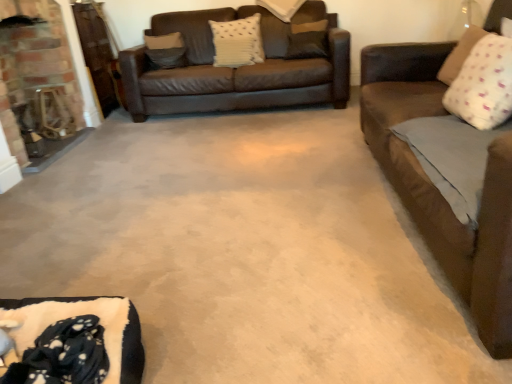
Question: Considering the positions of brick fireplace at left and white textured pillow at upper center, the third pillow viewed from the left, in the image, is brick fireplace at left taller or shorter than white textured pillow at upper center, the third pillow viewed from the left,?

Choices:
 (A) short
 (B) tall

Answer: (B)

Question: Is point (65, 67) closer or farther from the camera than point (286, 1)?

Choices:
 (A) farther
 (B) closer

Answer: (B)

Question: Which object is positioned farthest from the brown fabric pillow at upper center, the fourth pillow when ordered from left to right?

Choices:
 (A) black fleece blanket at lower left
 (B) brick fireplace at left
 (C) white textured pillow at center, the 5th pillow when ordered from right to left
 (D) suede-like beige pillow at upper left, which is the first pillow from back to front
 (E) white textured pillow at upper center, the fourth pillow viewed from the right

Answer: (A)

Question: Which is nearer to the white textured pillow at upper center, the fourth pillow viewed from the right?

Choices:
 (A) black fleece blanket at lower left
 (B) suede-like beige pillow at upper left, which is the first pillow from back to front
 (C) white soft pillow at upper right, the fifth pillow positioned from the left
 (D) white textured pillow at center, marked as the second pillow in a left-to-right arrangement
 (E) brown fabric pillow at upper center, the fourth pillow when ordered from left to right

Answer: (E)